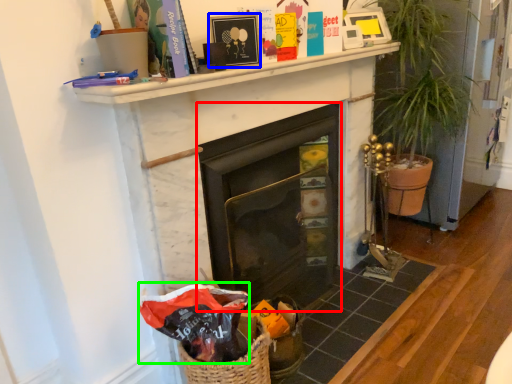
Question: Based on their relative distances, which object is nearer to fireplace (highlighted by a red box)? Choose from picture frame (highlighted by a blue box) and gift bag (highlighted by a green box).

Choices:
 (A) picture frame
 (B) gift bag

Answer: (B)